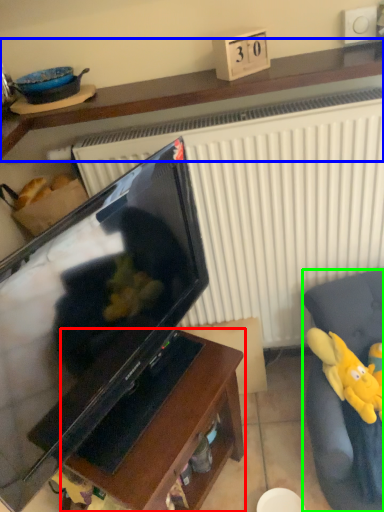
Question: Which is nearer to the furniture (highlighted by a red box)? furniture (highlighted by a blue box) or furniture (highlighted by a green box).

Choices:
 (A) furniture
 (B) furniture

Answer: (B)